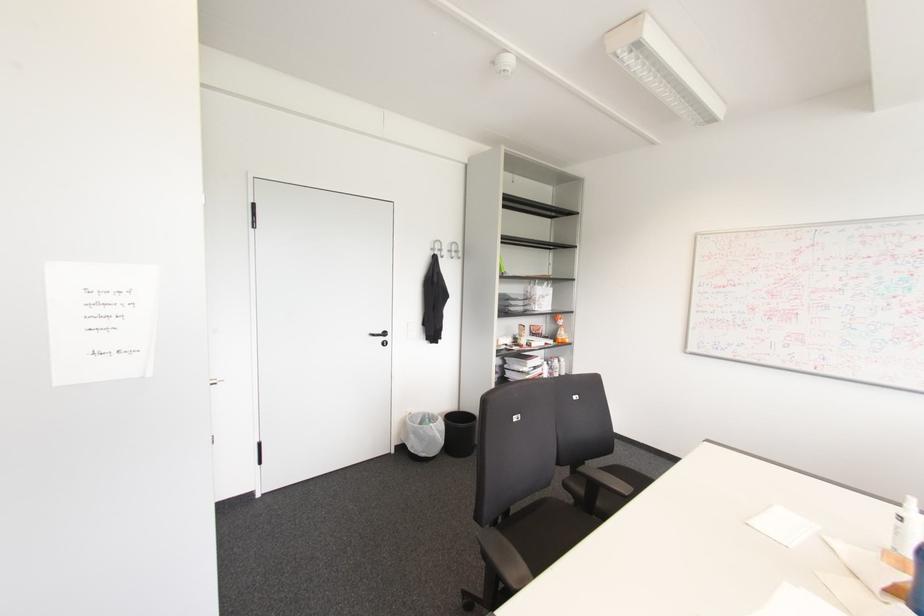
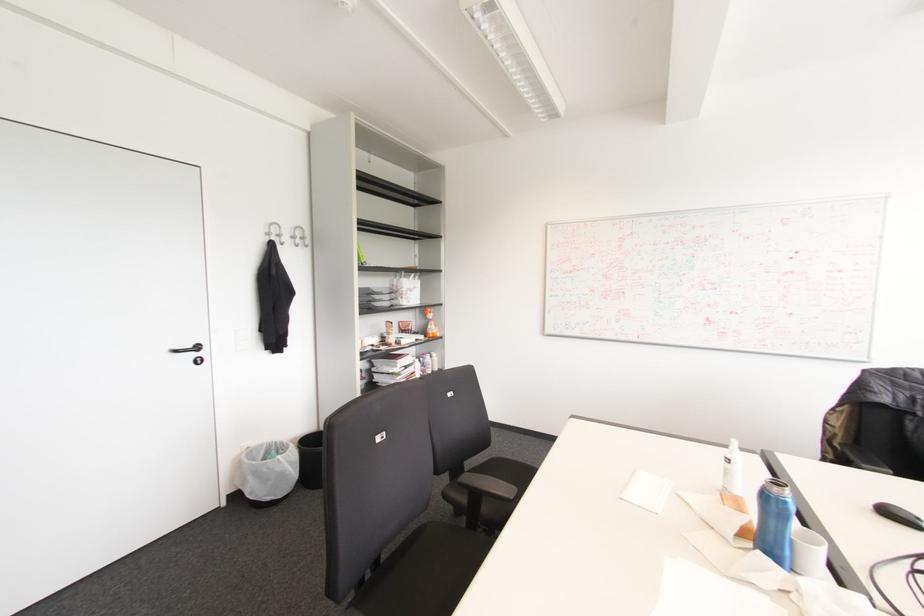
Locate, in the second image, the point that corresponds to point (432, 249) in the first image.

(266, 233)